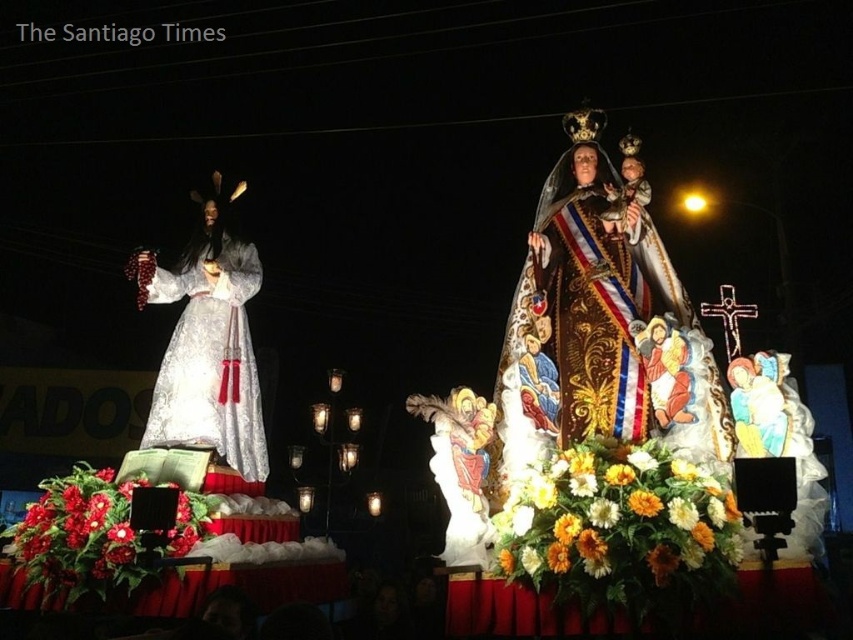
You are an event planner arranging a photo shoot for the floats. You need to ensure that the white satin statue at left and the red floral arrangement at lower left are both visible in the frame. Based on their sizes, which object should be placed closer to the camera to maintain visibility?

The white satin statue at left has a lesser width compared to the red floral arrangement at lower left. To ensure both are visible, the white satin statue at left should be placed closer to the camera since it is smaller and needs to be magnified to match the visibility of the larger red floral arrangement at lower left.

You are a photographer trying to capture the floats in the image. You notice two points marked at coordinates point (264, 442) and point (32, 557). Which point is closer to your camera lens?

Point (264, 442) is further to the camera than point (32, 557), so the point closer to your camera lens is point (32, 557).

You are standing in the crowd watching the nighttime religious procession. You want to take a photo of the white satin statue at left. Where should you position yourself to capture it in the frame?

To capture the white satin statue at left in your photo, position yourself so that your camera is aimed at the coordinates corresponding to point 0.544 on the horizontal axis and 0.244 on the vertical axis, as this is where the statue is located.